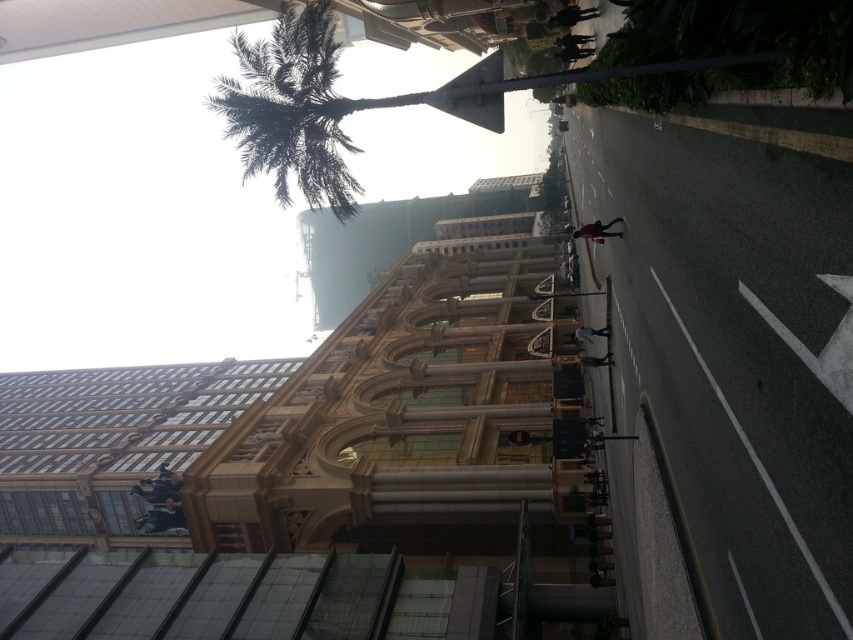
Who is lower down, green leafy palm tree at upper left or metallic pole at center?

metallic pole at center

Find the location of a particular element. This screenshot has height=640, width=853. green leafy palm tree at upper left is located at coordinates (291, 108).

At what (x,y) coordinates should I click in order to perform the action: click on green leafy palm tree at upper left. Please return your answer as a coordinate pair (x, y). The image size is (853, 640). Looking at the image, I should click on (291, 108).